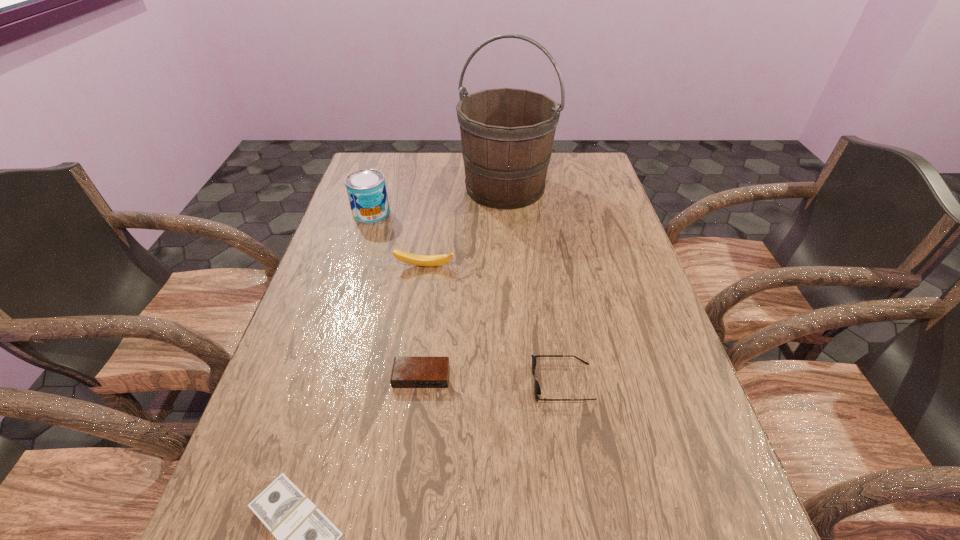
Find the location of `the tallest object`. the tallest object is located at coordinates (507, 134).

The height and width of the screenshot is (540, 960). I want to click on can, so coord(366,189).

The height and width of the screenshot is (540, 960). What are the coordinates of `the third tallest object` in the screenshot? It's located at (420, 260).

This screenshot has width=960, height=540. Find the location of `banana`. banana is located at coordinates (420, 260).

The width and height of the screenshot is (960, 540). In order to click on the fourth tallest object in this screenshot , I will do `click(537, 390)`.

Find the location of a particular element. This screenshot has width=960, height=540. alarm clock is located at coordinates (407, 372).

Locate an element on the screen. blank area located on the left of the bucket is located at coordinates (357, 188).

This screenshot has height=540, width=960. Find the location of `vacant region located on the back of the fifth shortest object`. vacant region located on the back of the fifth shortest object is located at coordinates (382, 180).

This screenshot has height=540, width=960. I want to click on vacant space located 0.180m at the stem of the fourth nearest object, so click(417, 322).

Locate an element on the screen. The height and width of the screenshot is (540, 960). vacant area situated on the front-facing side of the sunglasses is located at coordinates (379, 383).